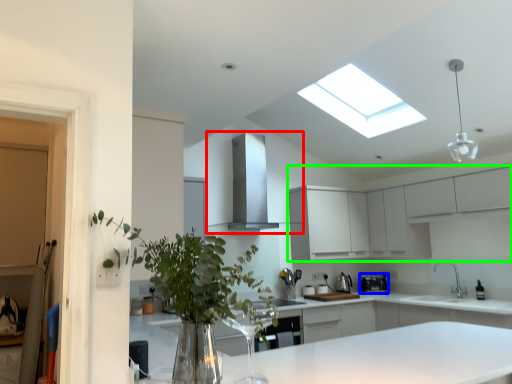
Question: Considering the real-world distances, which object is closest to exhaust hood (highlighted by a red box)? appliance (highlighted by a blue box) or cabinetry (highlighted by a green box).

Choices:
 (A) appliance
 (B) cabinetry

Answer: (B)